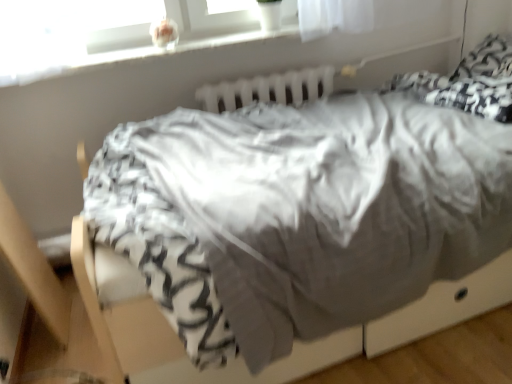
Question: Would you say white plastic radiator at upper center is to the left or to the right of white plastic window sill at upper center in the picture?

Choices:
 (A) right
 (B) left

Answer: (A)

Question: Is point (287, 94) closer or farther from the camera than point (48, 66)?

Choices:
 (A) closer
 (B) farther

Answer: (B)

Question: Is white plastic radiator at upper center bigger or smaller than white plastic window sill at upper center?

Choices:
 (A) small
 (B) big

Answer: (A)

Question: From the image's perspective, is white plastic window sill at upper center above or below white plastic radiator at upper center?

Choices:
 (A) below
 (B) above

Answer: (B)

Question: In terms of height, does white plastic window sill at upper center look taller or shorter compared to white plastic radiator at upper center?

Choices:
 (A) tall
 (B) short

Answer: (B)

Question: Is point (56, 64) closer or farther from the camera than point (224, 107)?

Choices:
 (A) farther
 (B) closer

Answer: (B)

Question: In the image, is white plastic window sill at upper center on the left side or the right side of white plastic radiator at upper center?

Choices:
 (A) left
 (B) right

Answer: (A)